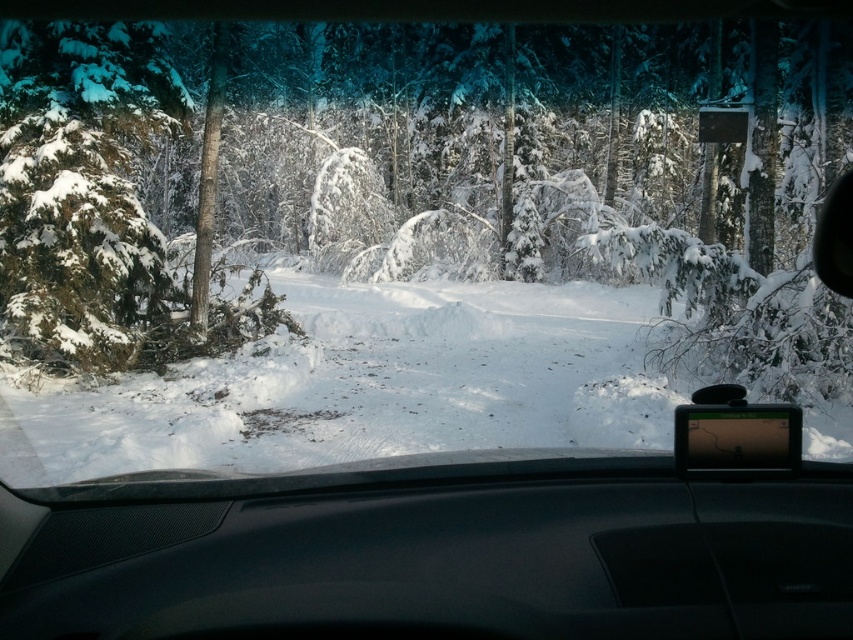
Can you confirm if black matte dashboard at center is wider than white fluffy snow at center?

No.

Is point (759, 604) positioned behind point (253, 342)?

No, (759, 604) is closer to viewer.

Between point (375, 630) and point (322, 314), which one is positioned behind?

Positioned behind is point (322, 314).

Where is `black matte dashboard at center`? black matte dashboard at center is located at coordinates 432,556.